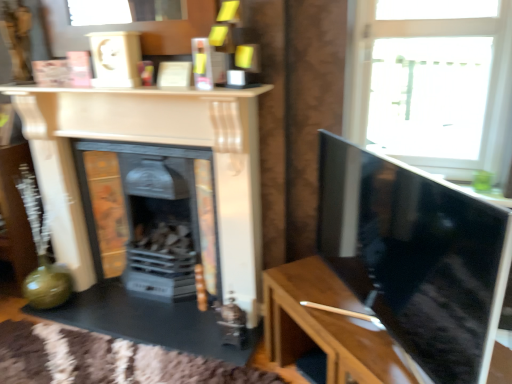
Question: Looking at the image, does wooden table at right seem bigger or smaller compared to matte black fireplace at center, marked as the 2th fireplace in a front-to-back arrangement?

Choices:
 (A) big
 (B) small

Answer: (B)

Question: Considering the positions of wooden table at right and matte black fireplace at center, positioned as the 1th fireplace in back-to-front order, in the image, is wooden table at right taller or shorter than matte black fireplace at center, positioned as the 1th fireplace in back-to-front order,?

Choices:
 (A) short
 (B) tall

Answer: (A)

Question: Which is farther from the black glossy tv at right?

Choices:
 (A) transparent glass window at upper right
 (B) matte cream fireplace at center, which ranks as the 1th fireplace in front-to-back order
 (C) matte black fireplace at center, marked as the 2th fireplace in a front-to-back arrangement
 (D) wooden table at right

Answer: (C)

Question: Estimate the real-world distances between objects in this image. Which object is farther from the matte black fireplace at center, marked as the 2th fireplace in a front-to-back arrangement?

Choices:
 (A) matte cream fireplace at center, which is the 2th fireplace in back-to-front order
 (B) black glossy tv at right
 (C) transparent glass window at upper right
 (D) wooden table at right

Answer: (C)